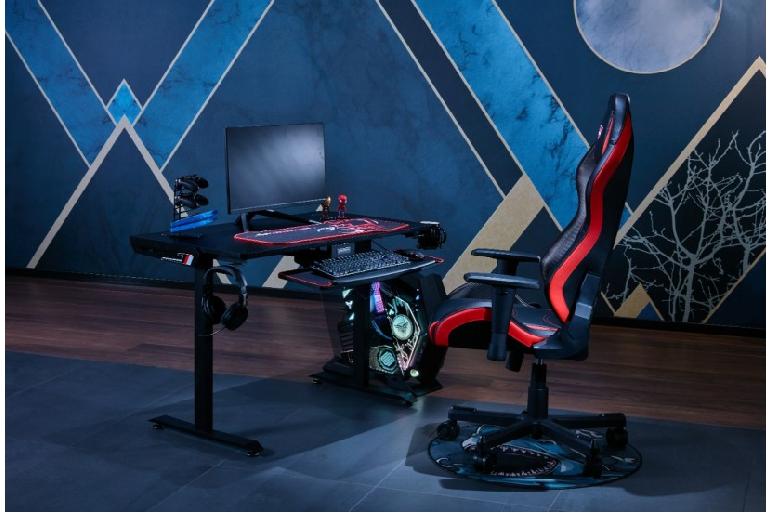
Where is `computer keyboard`? computer keyboard is located at coordinates (362, 260).